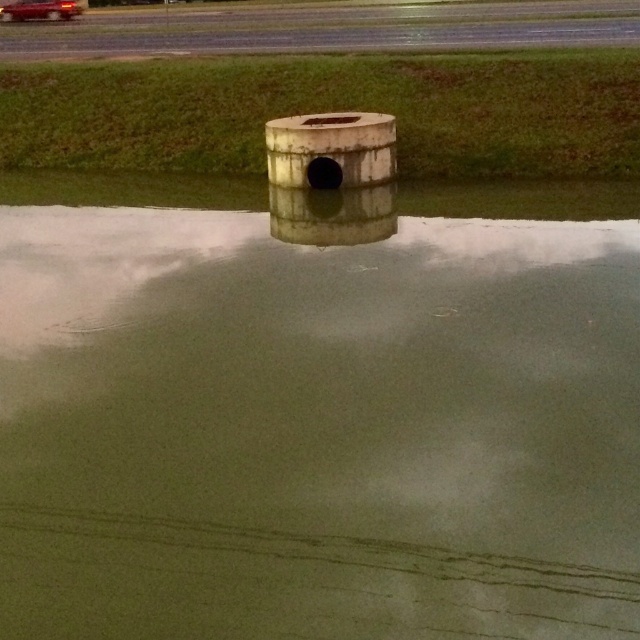
Question: Which of the following is the closest to the observer?

Choices:
 (A) concrete runway at upper center
 (B) matte concrete pipe at center

Answer: (B)

Question: Which object is positioned farthest from the concrete runway at upper center?

Choices:
 (A) metallic red car at upper left
 (B) green matte water at center

Answer: (B)

Question: Is concrete runway at upper center smaller than metallic red car at upper left?

Choices:
 (A) yes
 (B) no

Answer: (B)

Question: Is matte concrete pipe at center closer to camera compared to metallic red car at upper left?

Choices:
 (A) no
 (B) yes

Answer: (B)

Question: Which point is farther to the camera?

Choices:
 (A) click(x=355, y=394)
 (B) click(x=77, y=12)
 (C) click(x=307, y=227)
 (D) click(x=612, y=8)

Answer: (B)

Question: Can you confirm if green matte water at center is wider than matte concrete pipe at center?

Choices:
 (A) yes
 (B) no

Answer: (A)